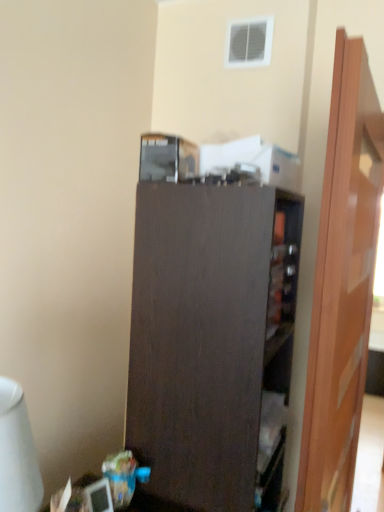
Where is `dark wood cupboard at center`? dark wood cupboard at center is located at coordinates (212, 342).

The width and height of the screenshot is (384, 512). Describe the element at coordinates (17, 453) in the screenshot. I see `white glossy table lamp at lower left` at that location.

Identify the location of dark wood cupboard at center. (212, 342).

What's the angular difference between white glossy table lamp at lower left and dark wood cupboard at center's facing directions?

The facing directions of white glossy table lamp at lower left and dark wood cupboard at center are 1.62 degrees apart.

Is white glossy table lamp at lower left positioned far away from dark wood cupboard at center?

No, white glossy table lamp at lower left is not far away from dark wood cupboard at center.

From the image's perspective, is white glossy table lamp at lower left located above dark wood cupboard at center?

Yes, from the image's perspective, white glossy table lamp at lower left is above dark wood cupboard at center.

Which of these two, white glossy table lamp at lower left or dark wood cupboard at center, stands taller?

Standing taller between the two is dark wood cupboard at center.

From a real-world perspective, which object rests below the other?

white glossy table lamp at lower left is physically lower.

Is wooden door at right oriented towards white glossy table lamp at lower left?

No, wooden door at right is not aimed at white glossy table lamp at lower left.

Is wooden door at right positioned far away from white glossy table lamp at lower left?

That's not correct — wooden door at right is a little close to white glossy table lamp at lower left.

Based on their sizes in the image, would you say wooden door at right is bigger or smaller than white glossy table lamp at lower left?

Clearly, wooden door at right is larger in size than white glossy table lamp at lower left.

Which object is more forward, dark wood cupboard at center or wooden door at right?

wooden door at right is more forward.

From a real-world perspective, is dark wood cupboard at center beneath wooden door at right?

Yes, from a real-world perspective, dark wood cupboard at center is under wooden door at right.

Who is bigger, dark wood cupboard at center or wooden door at right?

dark wood cupboard at center is bigger.

Can you confirm if dark wood cupboard at center is thinner than wooden door at right?

In fact, dark wood cupboard at center might be wider than wooden door at right.

Which object is further away from the camera taking this photo, wooden door at right or dark wood cupboard at center?

Positioned behind is dark wood cupboard at center.

Considering the sizes of wooden door at right and dark wood cupboard at center in the image, is wooden door at right wider or thinner than dark wood cupboard at center?

In the image, wooden door at right appears to be more narrow than dark wood cupboard at center.

From a real-world perspective, is wooden door at right over dark wood cupboard at center?

Yes, from a real-world perspective, wooden door at right is on top of dark wood cupboard at center.

Can you confirm if wooden door at right is smaller than dark wood cupboard at center?

Yes.

Is white glossy table lamp at lower left aimed at wooden door at right?

No, white glossy table lamp at lower left is not oriented towards wooden door at right.

Can you confirm if white glossy table lamp at lower left is positioned to the left of wooden door at right?

Yes, white glossy table lamp at lower left is to the left of wooden door at right.

Which of these two, white glossy table lamp at lower left or wooden door at right, is wider?

With larger width is white glossy table lamp at lower left.

How far apart are dark wood cupboard at center and white glossy table lamp at lower left?

They are 19.78 inches apart.

Choose the correct answer: Is dark wood cupboard at center inside white glossy table lamp at lower left or outside it?

dark wood cupboard at center is outside white glossy table lamp at lower left.

Looking at this image, which object is more forward, dark wood cupboard at center or white glossy table lamp at lower left?

white glossy table lamp at lower left is more forward.

Locate an element on the screen. The image size is (384, 512). table lamp above the dark wood cupboard at center (from the image's perspective) is located at coordinates [17, 453].

Where is `door that is on the right side of white glossy table lamp at lower left`? This screenshot has height=512, width=384. door that is on the right side of white glossy table lamp at lower left is located at coordinates (342, 284).

From the image, which object appears to be nearer to wooden door at right, white glossy table lamp at lower left or dark wood cupboard at center?

Among the two, dark wood cupboard at center is located nearer to wooden door at right.

When comparing their distances from wooden door at right, does dark wood cupboard at center or white glossy table lamp at lower left seem further?

white glossy table lamp at lower left is positioned further to the anchor wooden door at right.

From the image, which object appears to be nearer to dark wood cupboard at center, wooden door at right or white glossy table lamp at lower left?

The object closer to dark wood cupboard at center is wooden door at right.

From the image, which object appears to be farther from white glossy table lamp at lower left, dark wood cupboard at center or wooden door at right?

Among the two, wooden door at right is located further to white glossy table lamp at lower left.

Based on the photo, considering their positions, is white glossy table lamp at lower left positioned closer to dark wood cupboard at center than wooden door at right?

wooden door at right is closer to dark wood cupboard at center.

Estimate the real-world distances between objects in this image. Which object is further from white glossy table lamp at lower left, wooden door at right or dark wood cupboard at center?

The object further to white glossy table lamp at lower left is wooden door at right.

The image size is (384, 512). What are the coordinates of `cupboard between white glossy table lamp at lower left and wooden door at right from left to right` in the screenshot? It's located at click(x=212, y=342).